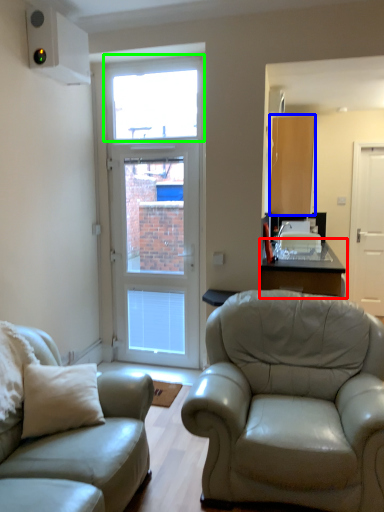
Question: Which is nearer to the table (highlighted by a red box)? cabinetry (highlighted by a blue box) or window (highlighted by a green box).

Choices:
 (A) cabinetry
 (B) window

Answer: (A)